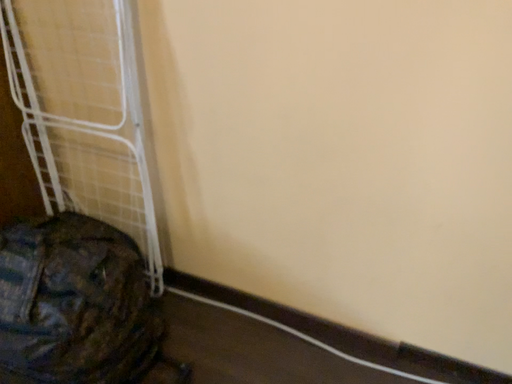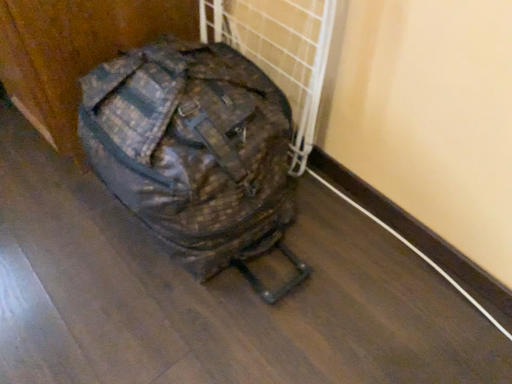
Question: Which way did the camera rotate in the video?

Choices:
 (A) rotated right
 (B) rotated left

Answer: (B)